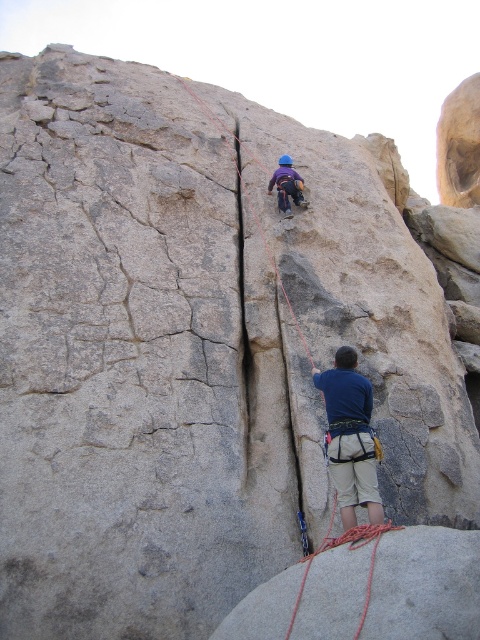
Question: Which of the following is the closest to the observer?

Choices:
 (A) (327, 541)
 (B) (269, 189)
 (C) (343, 380)

Answer: (A)

Question: Which point is closer to the camera taking this photo?

Choices:
 (A) (345, 516)
 (B) (278, 182)

Answer: (A)

Question: Does blue fabric shirt at lower center appear over red nylon rope at lower right?

Choices:
 (A) yes
 (B) no

Answer: (A)

Question: Which point is farther to the camera?

Choices:
 (A) red nylon rope at lower right
 (B) blue fabric shirt at lower center

Answer: (B)

Question: Can you confirm if blue fabric shirt at lower center is smaller than matte purple helmet at upper center?

Choices:
 (A) no
 (B) yes

Answer: (A)

Question: Can you confirm if red nylon rope at lower right is positioned to the left of matte purple helmet at upper center?

Choices:
 (A) no
 (B) yes

Answer: (A)